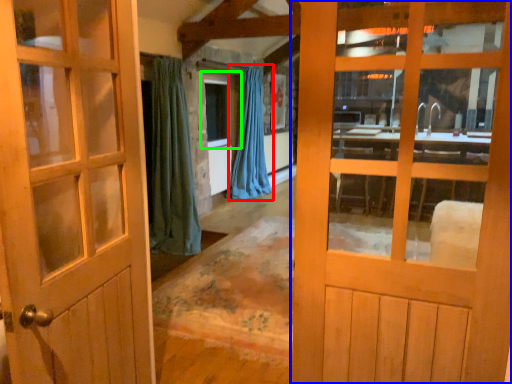
Question: Estimate the real-world distances between objects in this image. Which object is farther from curtain (highlighted by a red box), door (highlighted by a blue box) or window (highlighted by a green box)?

Choices:
 (A) door
 (B) window

Answer: (A)